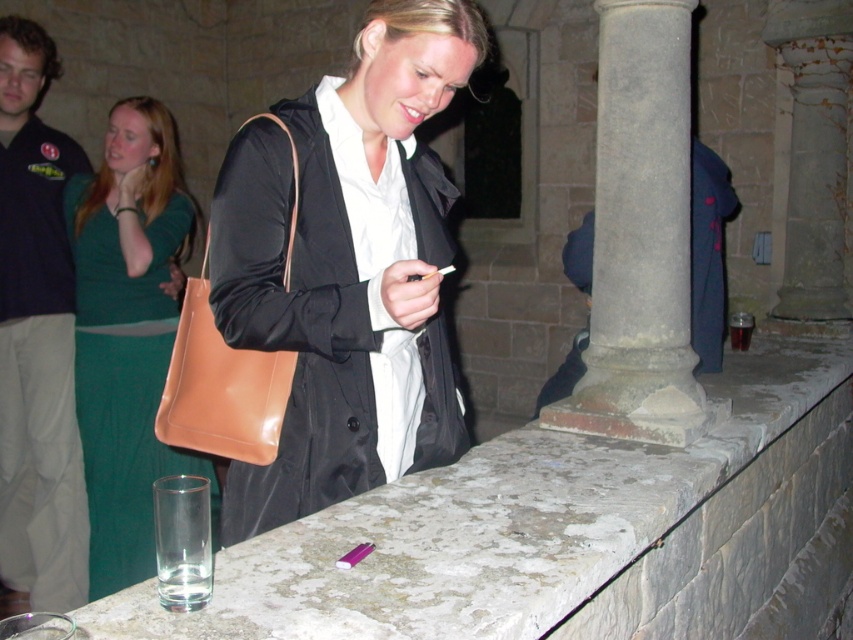
Is point (119, 380) positioned behind point (201, 378)?

Yes, it is.

Between green satin dress at left and brown leather handbag at center, which one has more height?

green satin dress at left is taller.

You are a GUI agent. You are given a task and a screenshot of the screen. Output one action in this format:
    pyautogui.click(x=<x>, y=<y>)
    Task: Click on the green satin dress at left
    The image size is (853, 640).
    Given the screenshot: What is the action you would take?
    pyautogui.click(x=126, y=333)

The height and width of the screenshot is (640, 853). Identify the location of green satin dress at left. (126, 333).

Which is more to the right, matte black coat at center or brown leather handbag at center?

matte black coat at center

Is matte black coat at center above brown leather handbag at center?

Incorrect, matte black coat at center is not positioned above brown leather handbag at center.

Who is more distant from viewer, (437,211) or (189,344)?

Positioned behind is point (437,211).

Identify the location of matte black coat at center. Image resolution: width=853 pixels, height=640 pixels. (347, 268).

Identify the location of matte black coat at center. The height and width of the screenshot is (640, 853). (347, 268).

The width and height of the screenshot is (853, 640). What do you see at coordinates (347, 268) in the screenshot? I see `matte black coat at center` at bounding box center [347, 268].

The image size is (853, 640). I want to click on matte black coat at center, so click(347, 268).